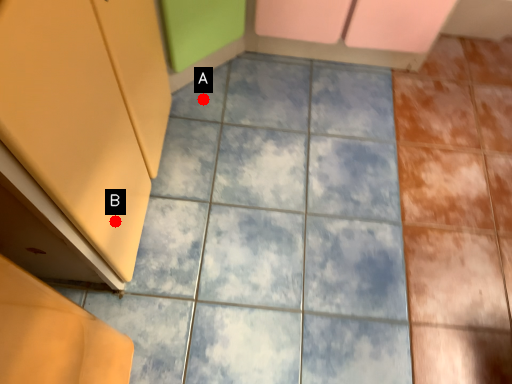
Question: Two points are circled on the image, labeled by A and B beside each circle. Which of the following is the farthest from the observer?

Choices:
 (A) A is further
 (B) B is further

Answer: (A)